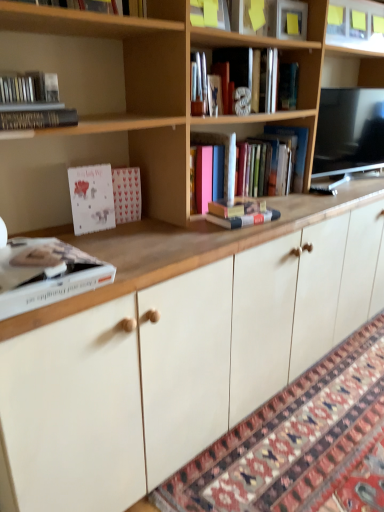
Where is `vacant area that lies in front of hardcover book at center, which is the first book in right-to-left order`? Image resolution: width=384 pixels, height=512 pixels. vacant area that lies in front of hardcover book at center, which is the first book in right-to-left order is located at coordinates (304, 198).